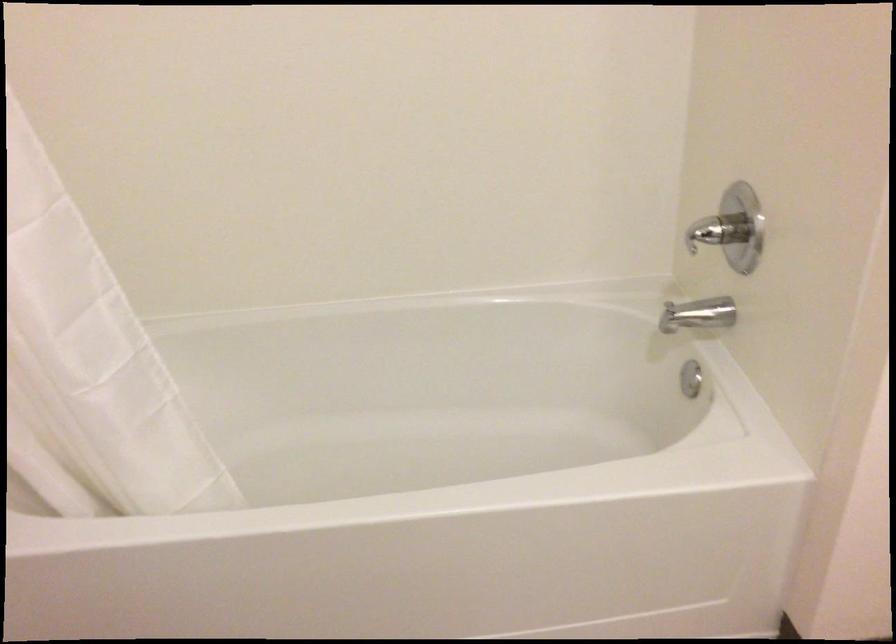
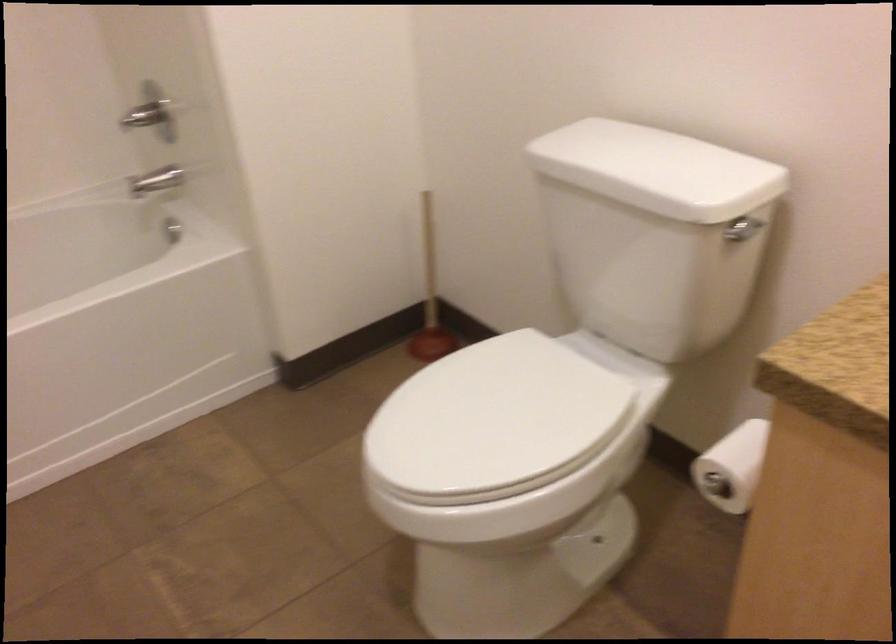
Question: The camera is either moving clockwise (left) or counter-clockwise (right) around the object. The first image is from the beginning of the video and the second image is from the end. Is the camera moving left or right when shooting the video?

Choices:
 (A) Left
 (B) Right

Answer: (A)